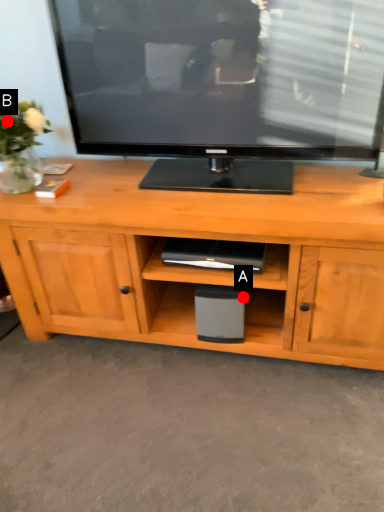
Question: Two points are circled on the image, labeled by A and B beside each circle. Which point is closer to the camera?

Choices:
 (A) A is closer
 (B) B is closer

Answer: (B)